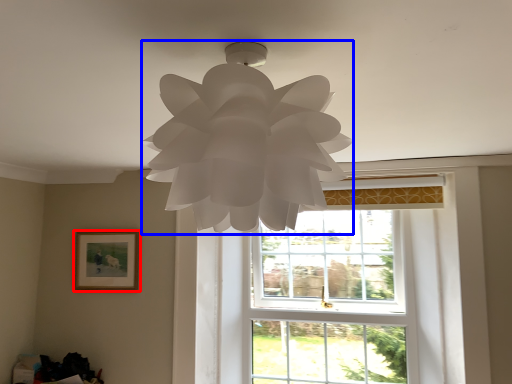
Question: Which object appears closest to the camera in this image, picture frame (highlighted by a red box) or lamp (highlighted by a blue box)?

Choices:
 (A) picture frame
 (B) lamp

Answer: (B)